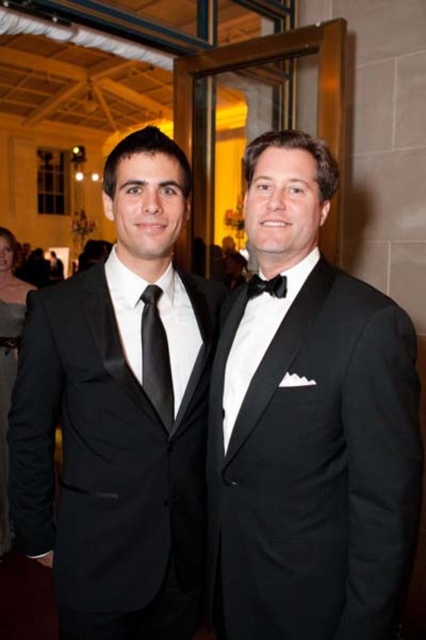
Is black satin tuxedo at center positioned at the back of matte black dress at lower left?

No, black satin tuxedo at center is in front of matte black dress at lower left.

Who is more distant from viewer, [342,518] or [5,330]?

Positioned behind is point [5,330].

Find the location of a particular element. black satin tuxedo at center is located at coordinates (310, 426).

Is black satin tuxedo at center smaller than black satin tie at center?

Actually, black satin tuxedo at center might be larger than black satin tie at center.

Is point (322, 516) positioned in front of point (149, 324)?

Yes, point (322, 516) is in front of point (149, 324).

Does point (357, 506) come farther from viewer compared to point (147, 381)?

No.

Locate an element on the screen. black satin tuxedo at center is located at coordinates (310, 426).

Is point (2, 321) farther from viewer compared to point (282, 291)?

That is True.

Can you confirm if matte black dress at lower left is wider than black satin bow tie at center?

Indeed, matte black dress at lower left has a greater width compared to black satin bow tie at center.

Is point (5, 540) in front of point (276, 282)?

No, (5, 540) is further to viewer.

Locate an element on the screen. This screenshot has width=426, height=640. matte black dress at lower left is located at coordinates (6, 403).